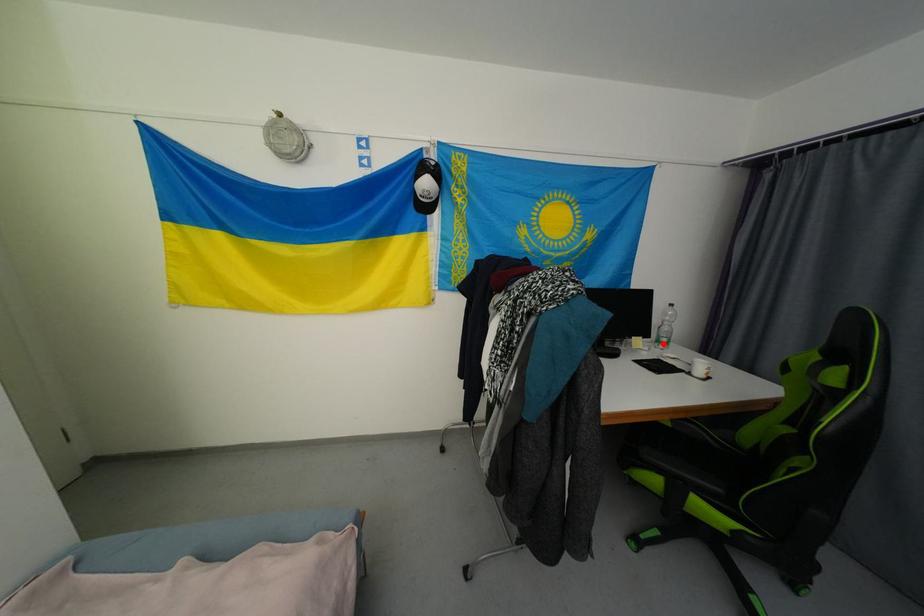
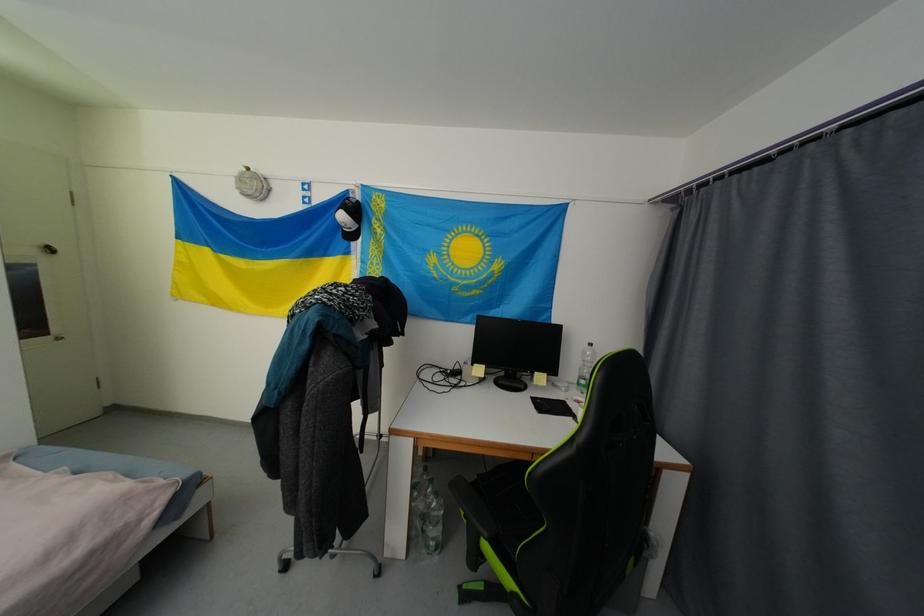
Where in the second image is the point corresponding to the highlighted location from the first image?

(584, 386)